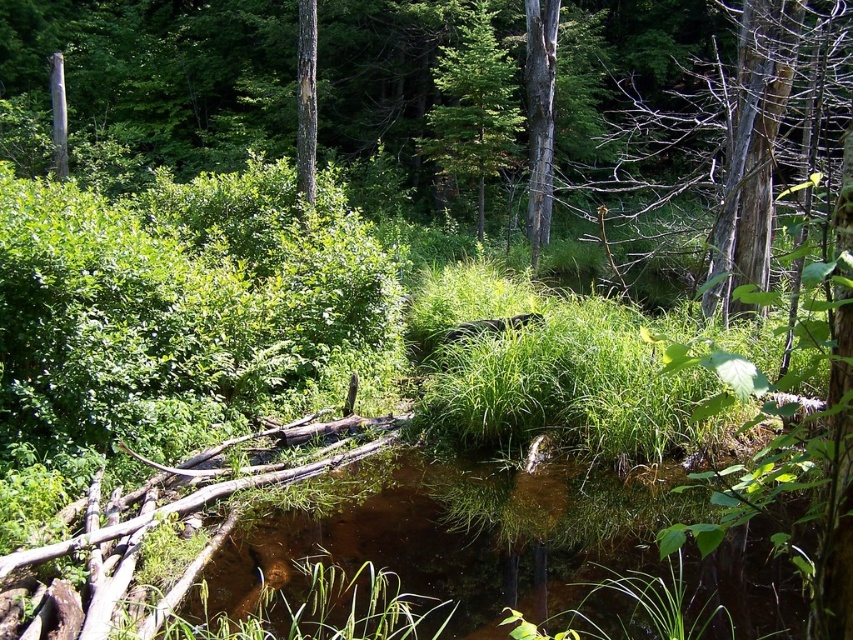
You are standing at the point marked by the coordinates point (473, 106) in the forest scene. What object is located exactly at that point?

The point (473, 106) indicates a green matte tree at upper center.

You are standing at the edge of the stream in the forest and notice two points marked in the scene. Which point, point (625, 518) or point (543, 74), is closer to you?

Point (625, 518) is closer to the viewer than point (543, 74).